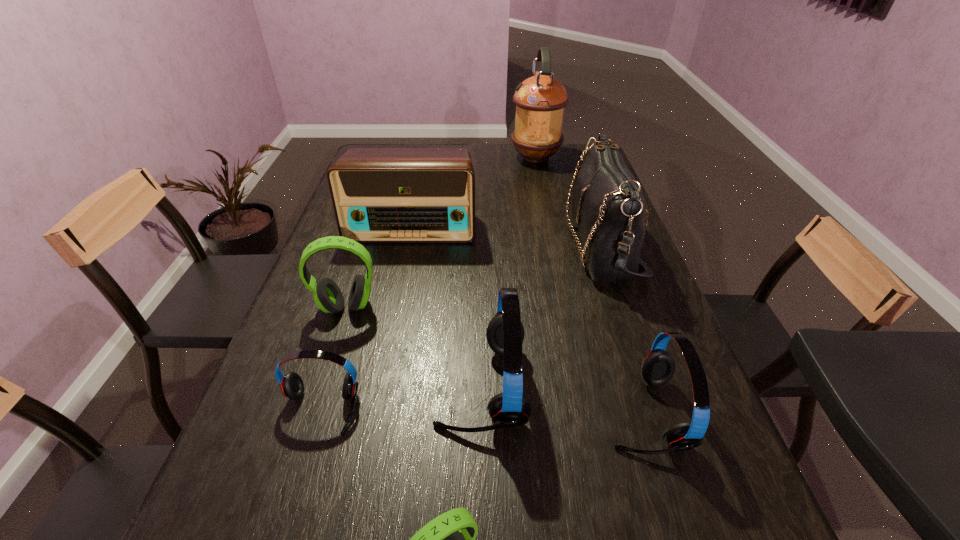
At what (x,y) coordinates should I click in order to perform the action: click on free space located 0.370m on the front of the tallest object. Please return your answer as a coordinate pair (x, y). Looking at the image, I should click on (550, 226).

I want to click on vacant space located 0.180m at the front of the handbag with chain and zipper, so click(x=508, y=245).

Where is `free region located at the front of the handbag with chain and zipper`? The height and width of the screenshot is (540, 960). free region located at the front of the handbag with chain and zipper is located at coordinates (493, 245).

Locate an element on the screen. This screenshot has height=540, width=960. vacant space located 0.340m at the front of the handbag with chain and zipper is located at coordinates click(x=452, y=245).

Identify the location of free spot located on the front-facing side of the radio receiver. (401, 278).

Locate an element on the screen. This screenshot has width=960, height=540. vacant position located 0.320m with the microphone attached to the side of the biggest red headset is located at coordinates (283, 386).

The height and width of the screenshot is (540, 960). What are the coordinates of `free space located with the microphone attached to the side of the biggest red headset` in the screenshot? It's located at (346, 386).

In order to click on vacant region located with the microphone attached to the side of the biggest red headset in this screenshot , I will do `click(326, 386)`.

The image size is (960, 540). I want to click on blank space located on the back of the bigger green headset, so click(359, 268).

The width and height of the screenshot is (960, 540). I want to click on vacant space located with the microphone attached to the side of the rightmost headset, so click(x=569, y=413).